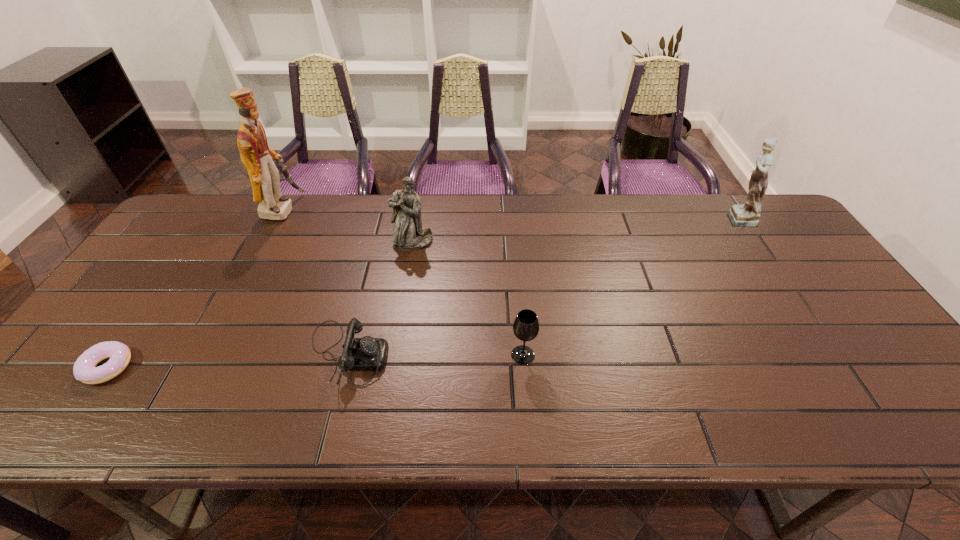
Choose which object is the second nearest neighbor to the left figurine. Please provide its 2D coordinates. Your answer should be formatted as a tuple, i.e. [(x, y)], where the tuple contains the x and y coordinates of a point satisfying the conditions above.

[(258, 158)]

Identify the location of free space that satisfies the following two spatial constraints: 1. on the front-facing side of the third shortest object; 2. on the left side of the telephone. The width and height of the screenshot is (960, 540). (347, 355).

At what (x,y) coordinates should I click in order to perform the action: click on vacant area that satisfies the following two spatial constraints: 1. on the front-facing side of the shorter figurine; 2. on the right side of the second object from right to left. Please return your answer as a coordinate pair (x, y). Looking at the image, I should click on (394, 355).

I want to click on free space that satisfies the following two spatial constraints: 1. on the front-facing side of the rightmost object; 2. on the front side of the shortest object, so click(x=836, y=367).

Image resolution: width=960 pixels, height=540 pixels. Find the location of `blank area in the image that satisfies the following two spatial constraints: 1. on the front-facing side of the second tallest object; 2. on the front-facing side of the nearer figurine`. blank area in the image that satisfies the following two spatial constraints: 1. on the front-facing side of the second tallest object; 2. on the front-facing side of the nearer figurine is located at coordinates (752, 242).

The height and width of the screenshot is (540, 960). In order to click on free space that satisfies the following two spatial constraints: 1. on the front-facing side of the telephone; 2. on the back side of the fourth tallest object in this screenshot , I will do `click(347, 355)`.

This screenshot has width=960, height=540. Find the location of `free spot that satisfies the following two spatial constraints: 1. on the front-facing side of the second shortest object; 2. on the right side of the wineglass`. free spot that satisfies the following two spatial constraints: 1. on the front-facing side of the second shortest object; 2. on the right side of the wineglass is located at coordinates (347, 355).